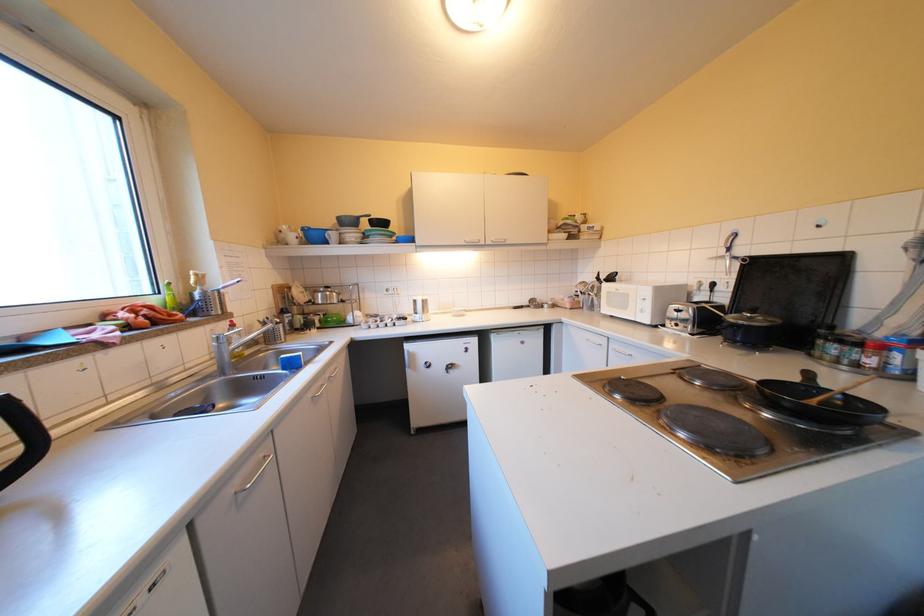
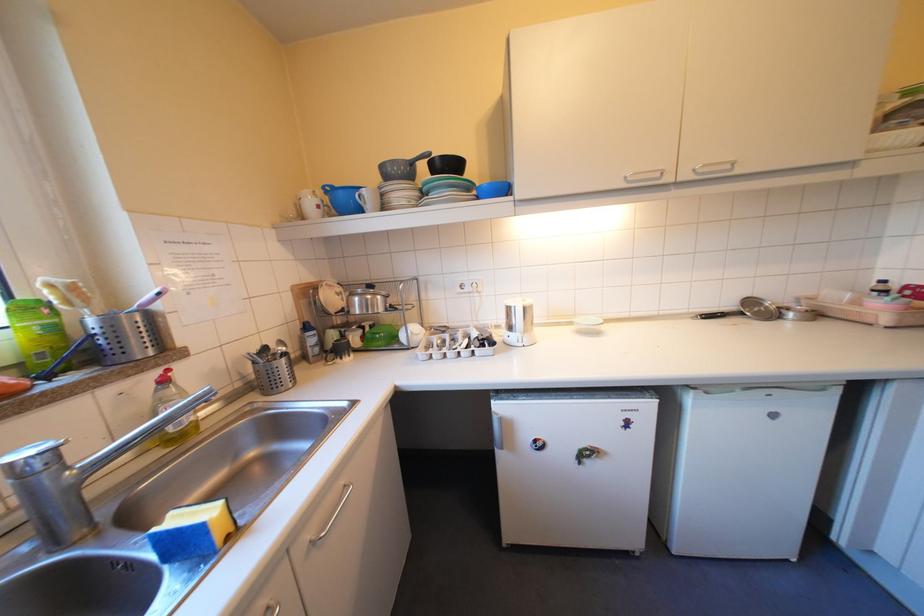
Find the pixel in the second image that matches point (341, 241) in the first image.

(373, 209)